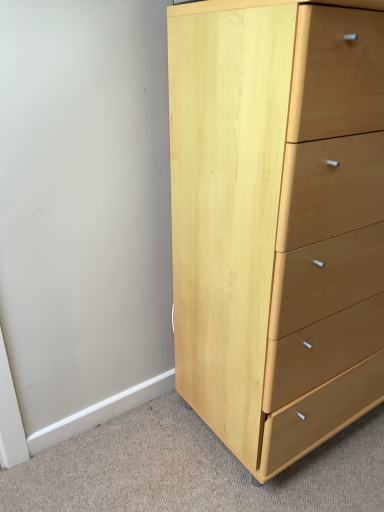
Locate an element on the screen. The width and height of the screenshot is (384, 512). natural wood chest of drawers at right is located at coordinates (277, 221).

The image size is (384, 512). What do you see at coordinates (277, 221) in the screenshot?
I see `natural wood chest of drawers at right` at bounding box center [277, 221].

Where is `natural wood chest of drawers at right`? natural wood chest of drawers at right is located at coordinates (277, 221).